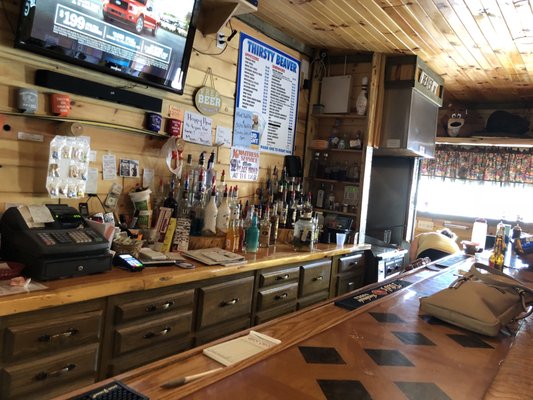
This screenshot has height=400, width=533. Identify the location of television. (120, 20).